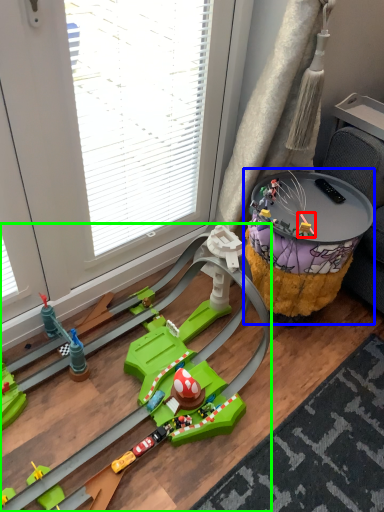
Question: Which object is positioned farthest from toy (highlighted by a red box)? Select from table (highlighted by a blue box) and toy (highlighted by a green box).

Choices:
 (A) table
 (B) toy

Answer: (B)